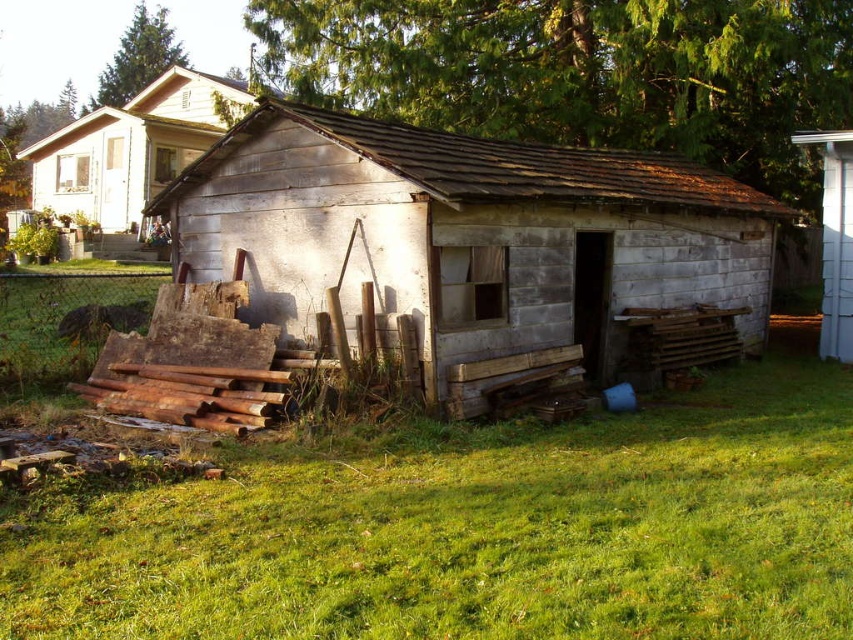
Question: Does weathered wood hut at center have a lesser width compared to weathered wood shed at upper left?

Choices:
 (A) no
 (B) yes

Answer: (B)

Question: Does green grass at lower center appear over white wood fence at right?

Choices:
 (A) yes
 (B) no

Answer: (B)

Question: Does weathered wood hut at center have a larger size compared to weathered wood shed at upper left?

Choices:
 (A) yes
 (B) no

Answer: (B)

Question: Among these points, which one is nearest to the camera?

Choices:
 (A) (167, 125)
 (B) (833, 141)
 (C) (711, 196)

Answer: (C)

Question: Estimate the real-world distances between objects in this image. Which object is closer to the weathered wood hut at center?

Choices:
 (A) white wood fence at right
 (B) weathered wood shed at upper left

Answer: (A)

Question: Based on their relative distances, which object is nearer to the weathered wood shed at upper left?

Choices:
 (A) weathered wood hut at center
 (B) white wood fence at right
 (C) green grass at lower center

Answer: (A)